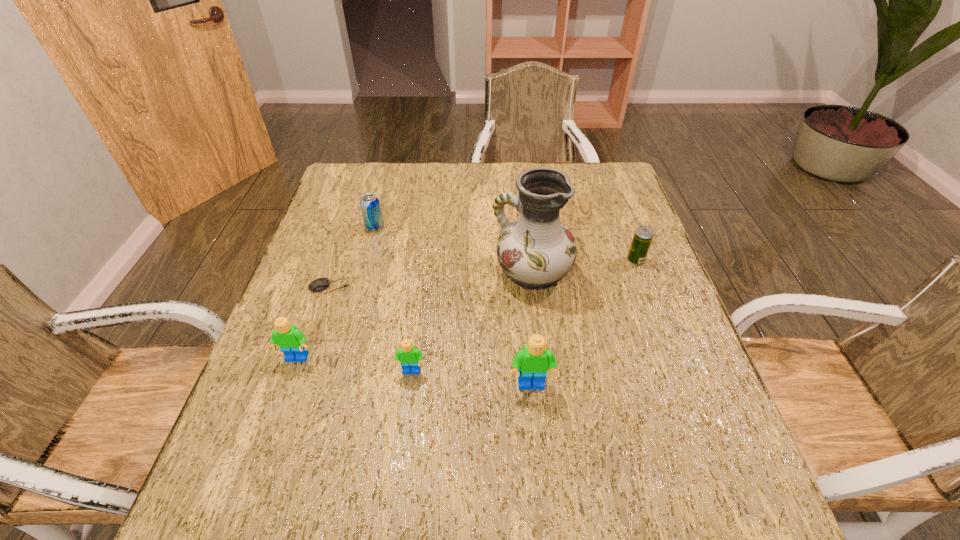
Locate an element on the screen. This screenshot has width=960, height=540. the second tallest Lego is located at coordinates (292, 341).

I want to click on the leftmost Lego, so 292,341.

This screenshot has width=960, height=540. Identify the location of the fourth object from left to right. (410, 357).

Identify the location of the second Lego from left to right. (410, 357).

Identify the location of the rightmost Lego. (533, 362).

In order to click on the sixth shortest object in this screenshot , I will do `click(533, 362)`.

This screenshot has width=960, height=540. Find the location of `the farthest object`. the farthest object is located at coordinates (370, 207).

Where is `the left beer can`? The image size is (960, 540). the left beer can is located at coordinates (370, 207).

Locate an element on the screen. The width and height of the screenshot is (960, 540). the tallest object is located at coordinates (535, 251).

Where is `the right beer can`? The image size is (960, 540). the right beer can is located at coordinates (643, 235).